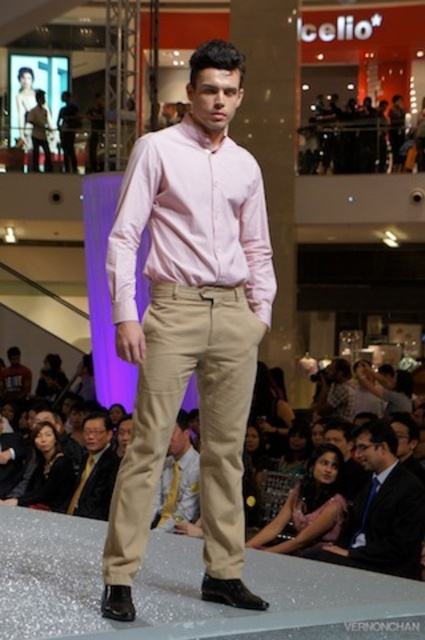
Question: Which point appears closest to the camera in this image?

Choices:
 (A) (221, 284)
 (B) (150, 371)

Answer: (B)

Question: Is matte khaki pants at center further to the viewer compared to beige cotton pants at center?

Choices:
 (A) no
 (B) yes

Answer: (A)

Question: Estimate the real-world distances between objects in this image. Which object is closer to the black leather jacket at lower left?

Choices:
 (A) beige cotton pants at center
 (B) light brown cotton pants at lower left
 (C) khaki cotton pants at center

Answer: (B)

Question: Is pink smooth dress shirt at center behind black leather jacket at lower left?

Choices:
 (A) yes
 (B) no

Answer: (B)

Question: Among these objects, which one is farthest from the camera?

Choices:
 (A) pink smooth dress shirt at center
 (B) matte khaki pants at center
 (C) beige cotton pants at center
 (D) black leather jacket at lower left

Answer: (D)

Question: Is matte khaki pants at center bigger than black leather jacket at lower left?

Choices:
 (A) yes
 (B) no

Answer: (A)